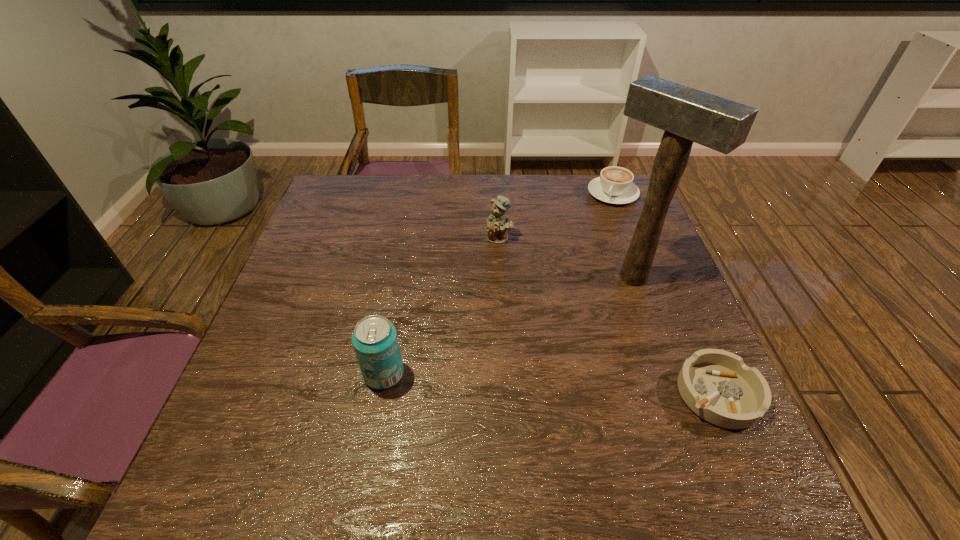
Where is `object at the near edge`? This screenshot has width=960, height=540. object at the near edge is located at coordinates pos(716,385).

I want to click on ashtray positioned at the right edge, so click(x=716, y=385).

I want to click on mallet positioned at the right edge, so click(687, 115).

Locate an element on the screen. This screenshot has width=960, height=540. cappuccino that is at the right edge is located at coordinates (615, 185).

The height and width of the screenshot is (540, 960). I want to click on object that is at the far right corner, so click(615, 185).

Where is `object that is at the near right corner`? This screenshot has width=960, height=540. object that is at the near right corner is located at coordinates (716, 385).

Where is `vacant area at the far edge`? vacant area at the far edge is located at coordinates (437, 209).

Find the location of `vacant space at the near edge of the desktop`. vacant space at the near edge of the desktop is located at coordinates (443, 420).

You are a GUI agent. You are given a task and a screenshot of the screen. Output one action in this format:
    pyautogui.click(x=<x>, y=<y>)
    Task: Click on the vacant space at the left edge
    Image resolution: width=960 pixels, height=540 pixels.
    Given the screenshot: What is the action you would take?
    pyautogui.click(x=319, y=300)

I want to click on free space at the right edge, so click(x=660, y=350).